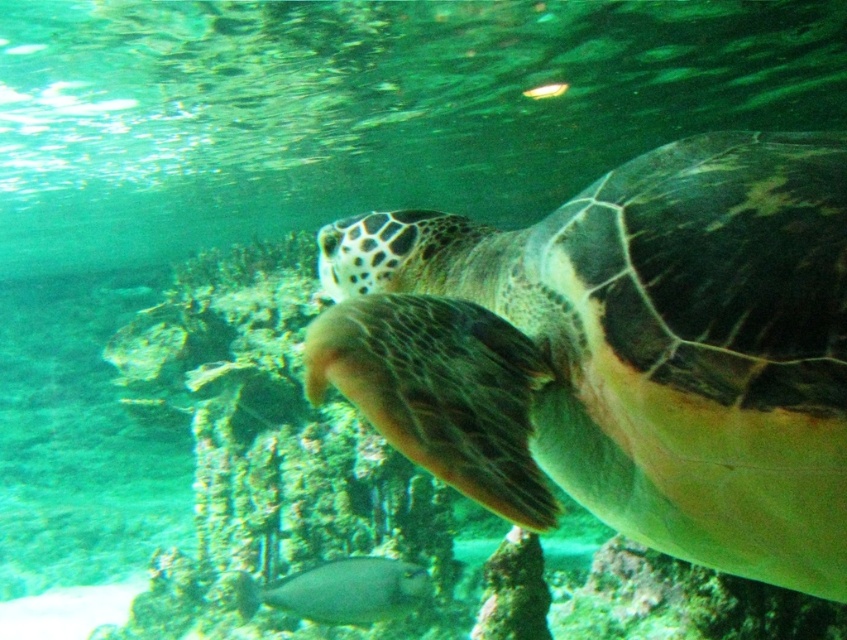
Question: Which point is closer to the camera?

Choices:
 (A) shiny silver fish at center
 (B) green matte turtle at center

Answer: (B)

Question: Is green matte turtle at center positioned before shiny silver fish at center?

Choices:
 (A) no
 (B) yes

Answer: (B)

Question: Which point appears farthest from the camera in this image?

Choices:
 (A) (410, 563)
 (B) (491, 300)

Answer: (A)

Question: Does green matte turtle at center appear over shiny silver fish at center?

Choices:
 (A) yes
 (B) no

Answer: (A)

Question: Where is green matte turtle at center located in relation to shiny silver fish at center in the image?

Choices:
 (A) above
 (B) below

Answer: (A)

Question: Which of the following is the closest to the observer?

Choices:
 (A) green matte turtle at center
 (B) shiny silver fish at center

Answer: (A)